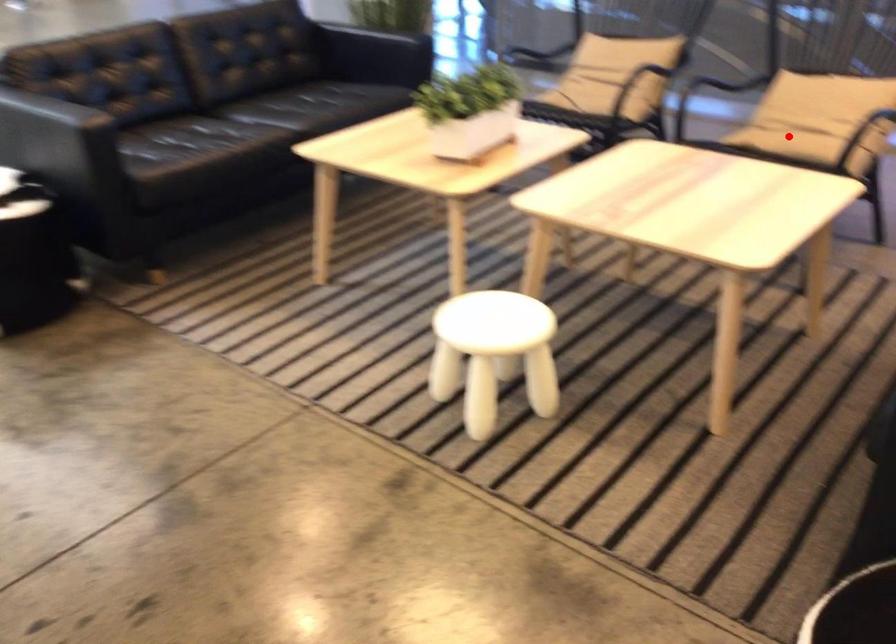
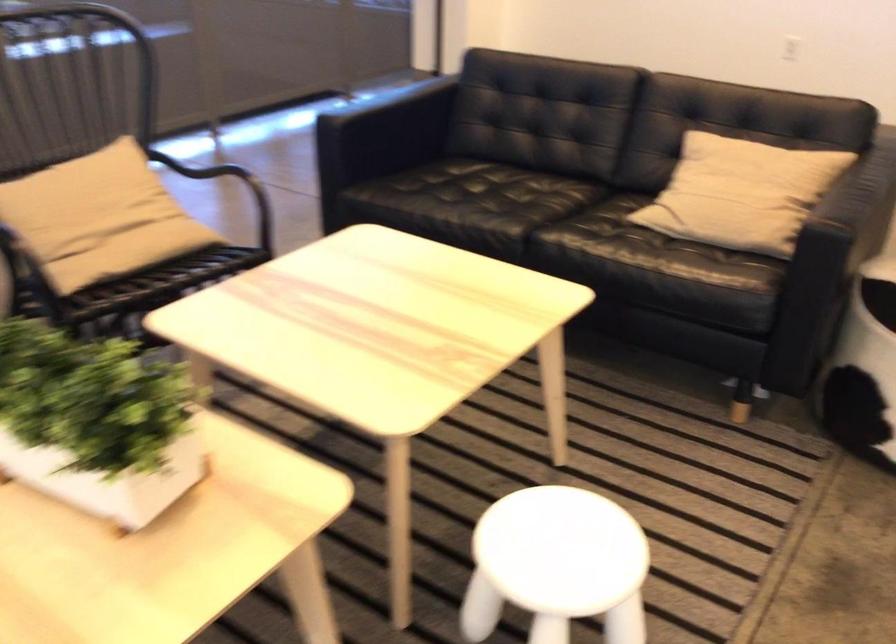
Where in the second image is the point corresponding to the highlighted location from the first image?

(151, 254)